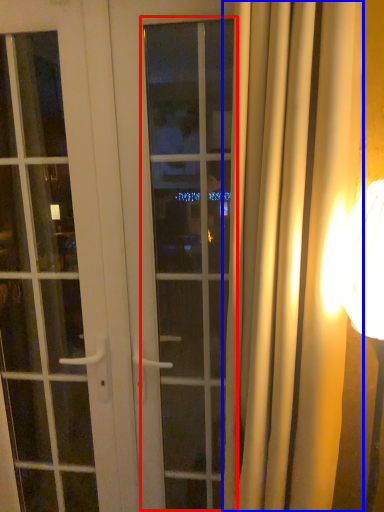
Question: Which point is closer to the camera, window (highlighted by a red box) or curtain (highlighted by a blue box)?

Choices:
 (A) window
 (B) curtain

Answer: (B)